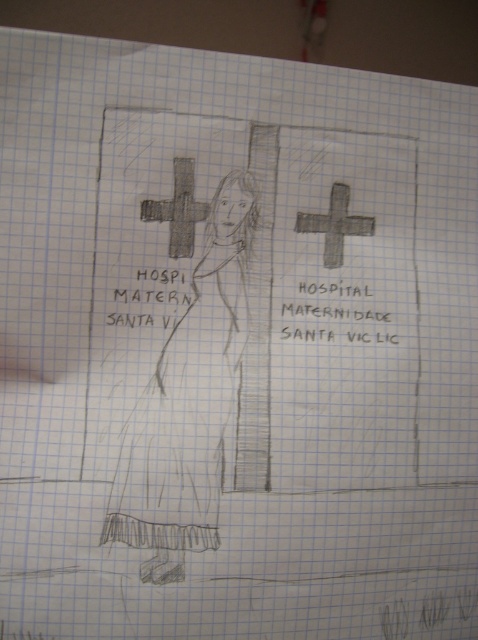
Between charcoal textured cross at center and gray textured cross at center, which one has less height?

Standing shorter between the two is gray textured cross at center.

Between charcoal textured cross at center and gray textured cross at center, which one appears on the left side from the viewer's perspective?

charcoal textured cross at center

At what (x,y) coordinates should I click in order to perform the action: click on charcoal textured cross at center. Please return your answer as a coordinate pair (x, y). Looking at the image, I should click on (177, 209).

Is matte black dress at center behind gray textured cross at center?

No, it is not.

Can you confirm if matte black dress at center is bigger than gray textured cross at center?

Correct, matte black dress at center is larger in size than gray textured cross at center.

Find the location of a particular element. matte black dress at center is located at coordinates (184, 417).

Measure the distance between matte black dress at center and camera.

A distance of 19.29 inches exists between matte black dress at center and camera.

Does matte black dress at center appear on the left side of charcoal textured cross at center?

Incorrect, matte black dress at center is not on the left side of charcoal textured cross at center.

This screenshot has width=478, height=640. Find the location of `matte black dress at center`. matte black dress at center is located at coordinates (184, 417).